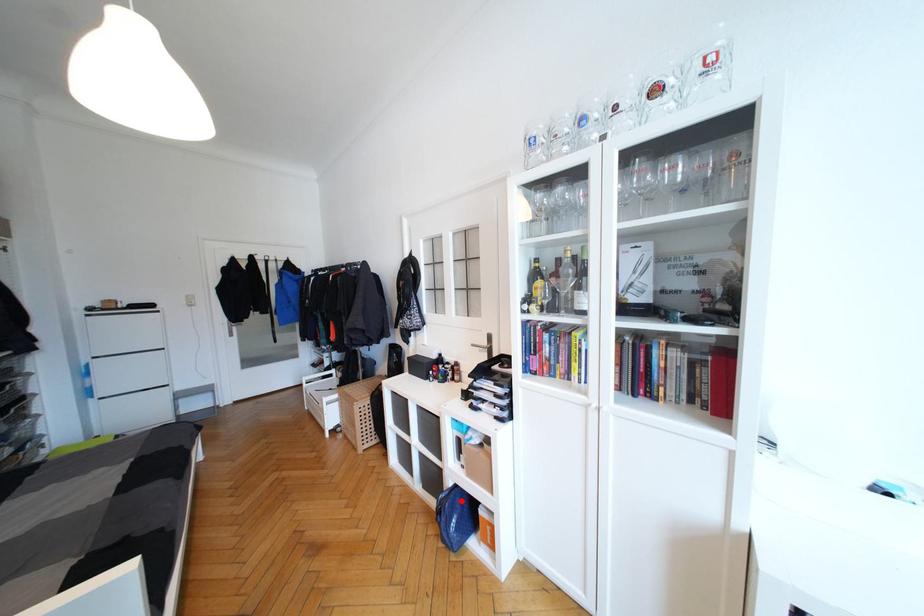
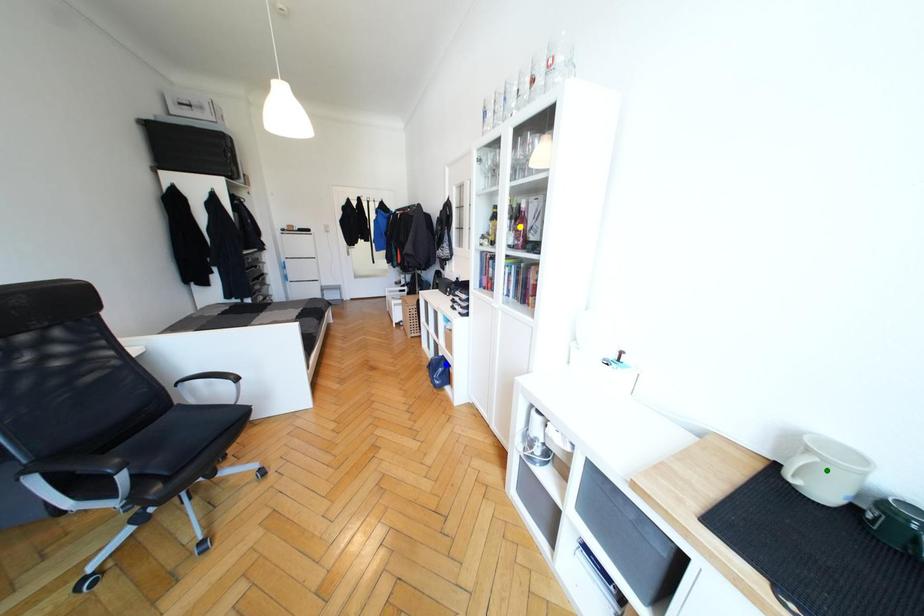
Question: I am providing you with two images of the same scene from different viewpoints. A red point is marked on the first image. You are given multiple points on the second image. Which spot in image 2 lines up with the point in image 1?

Choices:
 (A) blue point
 (B) yellow point
 (C) green point

Answer: (A)